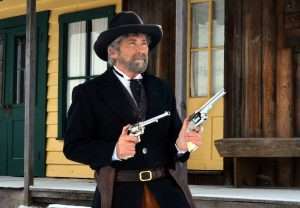
The height and width of the screenshot is (208, 300). I want to click on window, so click(76, 57), click(198, 36).